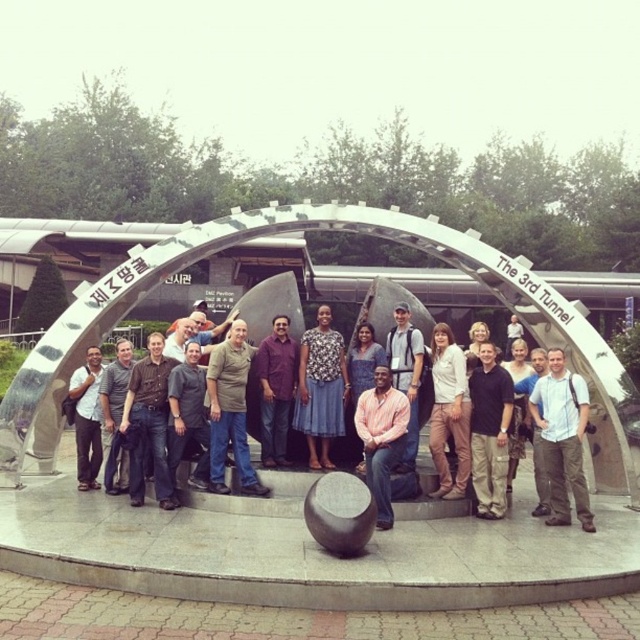
Question: Which of the following is the closest to the observer?

Choices:
 (A) pink shirt at center
 (B) denim shirt at center
 (C) pink cotton shirt at center

Answer: (C)

Question: Can you confirm if denim skirt at center is thinner than purple shirt at center?

Choices:
 (A) yes
 (B) no

Answer: (B)

Question: Which of the following is the farthest from the observer?

Choices:
 (A) denim shirt at center
 (B) khaki pants at center
 (C) brown leather shirt at center

Answer: (A)

Question: Can you confirm if pink shirt at center is positioned to the left of matte black jacket at center?

Choices:
 (A) no
 (B) yes

Answer: (A)

Question: Which point is closer to the camera?

Choices:
 (A) pos(180,444)
 (B) pos(394,387)

Answer: (A)

Question: Does white cotton shirt at center have a lesser width compared to pink shirt at center?

Choices:
 (A) no
 (B) yes

Answer: (A)